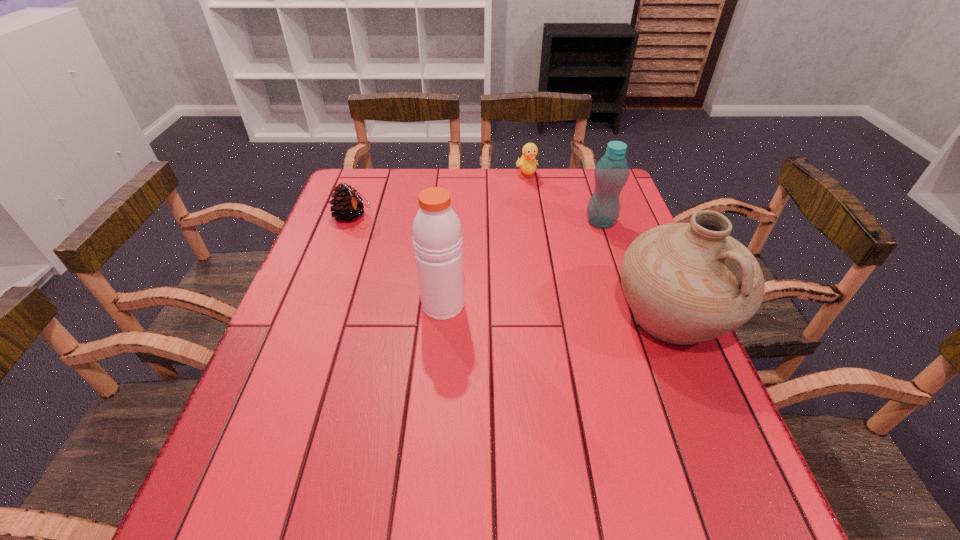
Locate an element on the screen. The height and width of the screenshot is (540, 960). vacant space located 0.260m at the front cap of the water bottle is located at coordinates (555, 284).

I want to click on vacant space situated 0.390m with a leaf charm attached to the pinecone, so click(473, 278).

The image size is (960, 540). I want to click on vacant space located 0.170m with a leaf charm attached to the pinecone, so click(x=410, y=244).

Image resolution: width=960 pixels, height=540 pixels. In order to click on free spot located 0.130m with a leaf charm attached to the pinecone in this screenshot , I will do `click(399, 239)`.

At what (x,y) coordinates should I click in order to perform the action: click on vacant space situated 0.250m on the front-facing side of the third object from left to right. Please return your answer as a coordinate pair (x, y). Looking at the image, I should click on (550, 231).

Locate an element on the screen. Image resolution: width=960 pixels, height=540 pixels. blank space located on the front-facing side of the third object from left to right is located at coordinates (552, 235).

I want to click on blank area located on the front-facing side of the third object from left to right, so click(x=551, y=233).

Identify the location of pinecone that is positioned at the far edge. Image resolution: width=960 pixels, height=540 pixels. (348, 204).

Where is `duckling located in the far edge section of the desktop`? duckling located in the far edge section of the desktop is located at coordinates (527, 163).

Where is `object located in the left edge section of the desktop`? Image resolution: width=960 pixels, height=540 pixels. object located in the left edge section of the desktop is located at coordinates (348, 204).